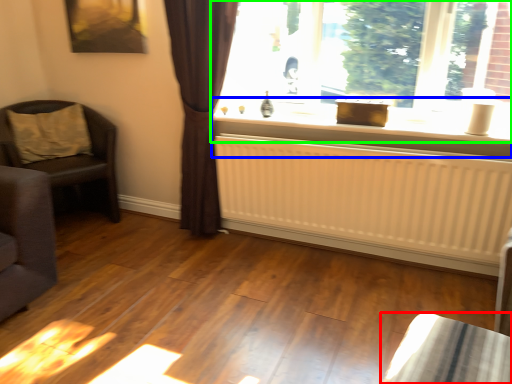
Question: Estimate the real-world distances between objects in this image. Which object is farther from furniture (highlighted by a red box), window sill (highlighted by a blue box) or window (highlighted by a green box)?

Choices:
 (A) window sill
 (B) window

Answer: (B)